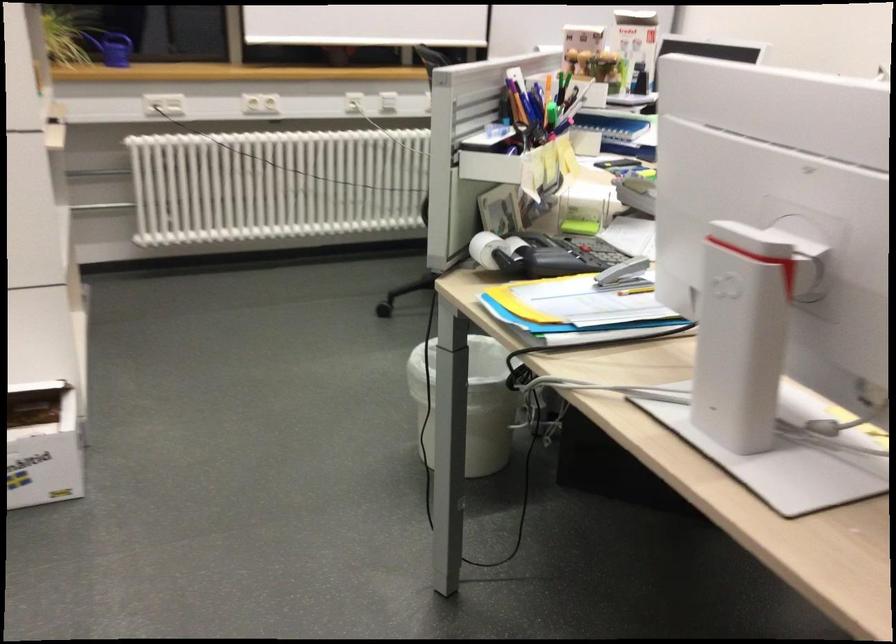
What are the coordinates of `white trash can` in the screenshot? It's located at (470, 404).